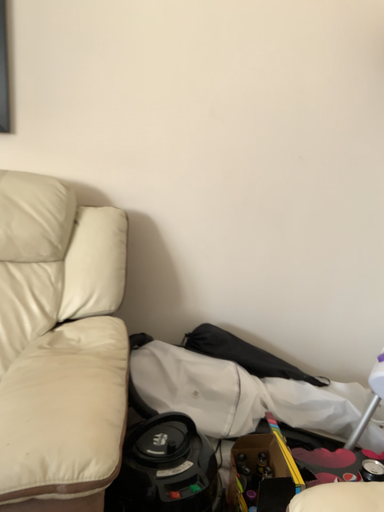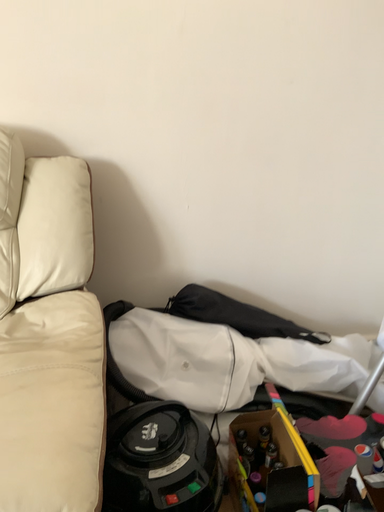
Question: How did the camera likely rotate when shooting the video?

Choices:
 (A) rotated upward
 (B) rotated downward

Answer: (B)